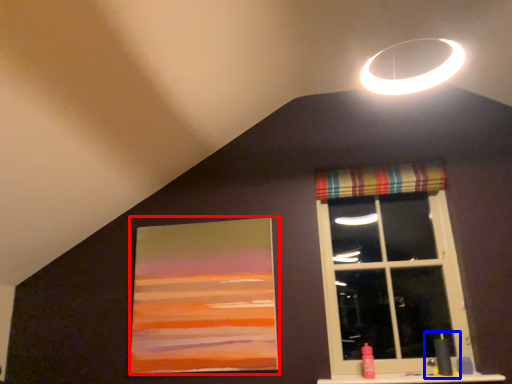
Question: Among these objects, which one is farthest to the camera, picture frame (highlighted by a red box) or sink (highlighted by a blue box)?

Choices:
 (A) picture frame
 (B) sink

Answer: (A)